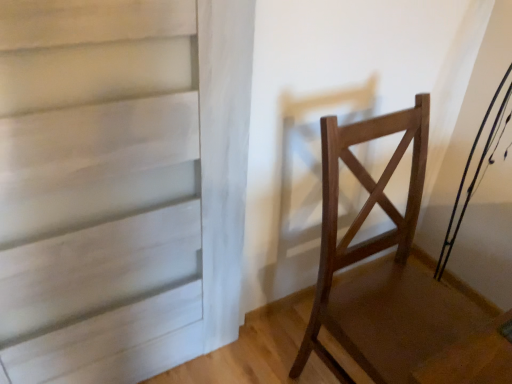
Question: Does white matte door at center appear on the left side of wooden chair at right?

Choices:
 (A) no
 (B) yes

Answer: (B)

Question: Is white matte door at center bigger than wooden chair at right?

Choices:
 (A) yes
 (B) no

Answer: (B)

Question: Can you confirm if white matte door at center is positioned to the right of wooden chair at right?

Choices:
 (A) no
 (B) yes

Answer: (A)

Question: Is white matte door at center turned away from wooden chair at right?

Choices:
 (A) yes
 (B) no

Answer: (B)

Question: Could you tell me if white matte door at center is turned towards wooden chair at right?

Choices:
 (A) no
 (B) yes

Answer: (A)

Question: Considering the relative sizes of white matte door at center and wooden chair at right in the image provided, is white matte door at center taller than wooden chair at right?

Choices:
 (A) no
 (B) yes

Answer: (B)

Question: Can you confirm if wooden chair at right is shorter than white matte door at center?

Choices:
 (A) no
 (B) yes

Answer: (B)

Question: Is wooden chair at right positioned before white matte door at center?

Choices:
 (A) yes
 (B) no

Answer: (B)

Question: Would you say white matte door at center is part of wooden chair at right's contents?

Choices:
 (A) no
 (B) yes

Answer: (A)

Question: Considering the relative sizes of wooden chair at right and white matte door at center in the image provided, is wooden chair at right wider than white matte door at center?

Choices:
 (A) yes
 (B) no

Answer: (A)

Question: From a real-world perspective, is wooden chair at right located higher than white matte door at center?

Choices:
 (A) no
 (B) yes

Answer: (A)

Question: From a real-world perspective, is wooden chair at right below white matte door at center?

Choices:
 (A) no
 (B) yes

Answer: (B)

Question: Based on their sizes in the image, would you say wooden chair at right is bigger or smaller than white matte door at center?

Choices:
 (A) big
 (B) small

Answer: (A)